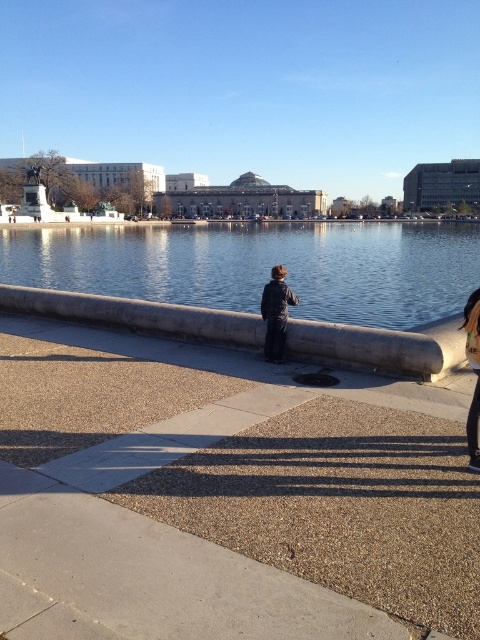
Question: Considering the relative positions of gray concrete pavement at center and clear water at center in the image provided, where is gray concrete pavement at center located with respect to clear water at center?

Choices:
 (A) above
 (B) below

Answer: (B)

Question: Considering the real-world distances, which object is farthest from the gray concrete pavement at center?

Choices:
 (A) matte black jacket at center
 (B) dark blue jeans at center
 (C) clear water at center

Answer: (C)

Question: Which object is the closest to the gray concrete pavement at center?

Choices:
 (A) matte black jacket at center
 (B) dark blue jeans at center
 (C) clear water at center

Answer: (B)

Question: Which point is farther to the camera?

Choices:
 (A) dark blue jeans at center
 (B) clear water at center

Answer: (B)

Question: From the image, what is the correct spatial relationship of dark blue jeans at center in relation to matte black jacket at center?

Choices:
 (A) right
 (B) left

Answer: (B)

Question: Is gray concrete pavement at center positioned at the back of dark blue jeans at center?

Choices:
 (A) no
 (B) yes

Answer: (A)